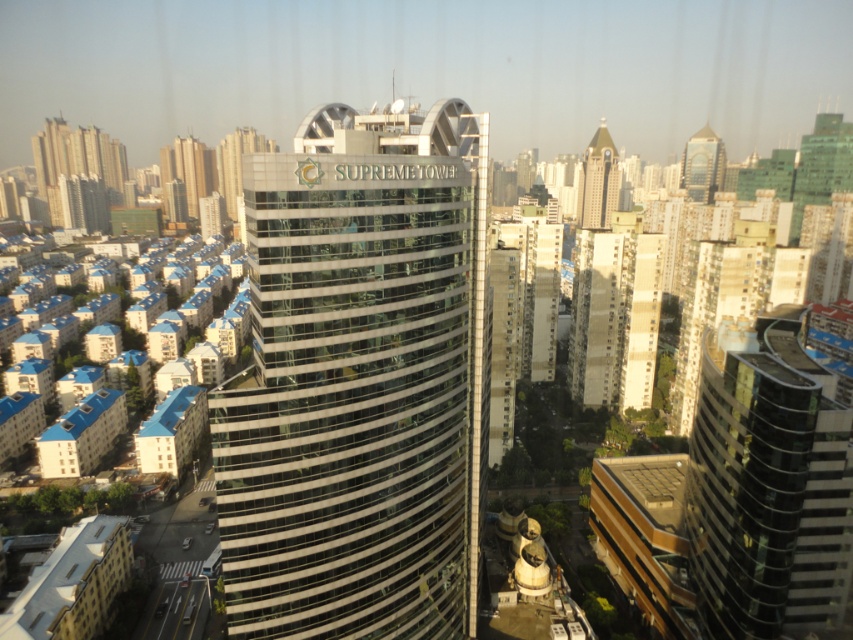
Can you confirm if black glass building at right is positioned to the right of beige concrete building at center?

Correct, you'll find black glass building at right to the right of beige concrete building at center.

Is black glass building at right positioned in front of beige concrete building at center?

Yes, it is in front of beige concrete building at center.

Between point (821, 522) and point (582, 253), which one is positioned in front?

Positioned in front is point (821, 522).

Locate an element on the screen. black glass building at right is located at coordinates (769, 486).

Does glassy silver skyscraper at center have a lesser height compared to beige concrete building at center?

Incorrect, glassy silver skyscraper at center's height does not fall short of beige concrete building at center's.

Who is positioned more to the right, glassy silver skyscraper at center or beige concrete building at center?

Positioned to the right is beige concrete building at center.

The width and height of the screenshot is (853, 640). What do you see at coordinates (358, 381) in the screenshot? I see `glassy silver skyscraper at center` at bounding box center [358, 381].

Where is `glassy silver skyscraper at center`? glassy silver skyscraper at center is located at coordinates (358, 381).

Consider the image. Which of these two, glassy silver skyscraper at center or black glass building at right, stands taller?

glassy silver skyscraper at center

Is glassy silver skyscraper at center thinner than black glass building at right?

No, glassy silver skyscraper at center is not thinner than black glass building at right.

Measure the distance between glassy silver skyscraper at center and camera.

glassy silver skyscraper at center and camera are 74.41 meters apart from each other.

Where is `glassy silver skyscraper at center`? This screenshot has height=640, width=853. glassy silver skyscraper at center is located at coordinates point(358,381).